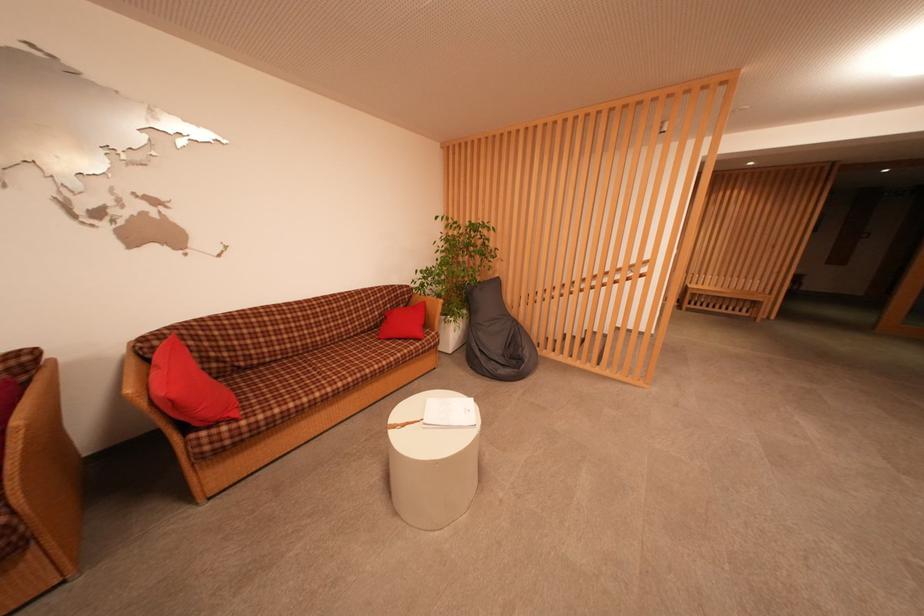
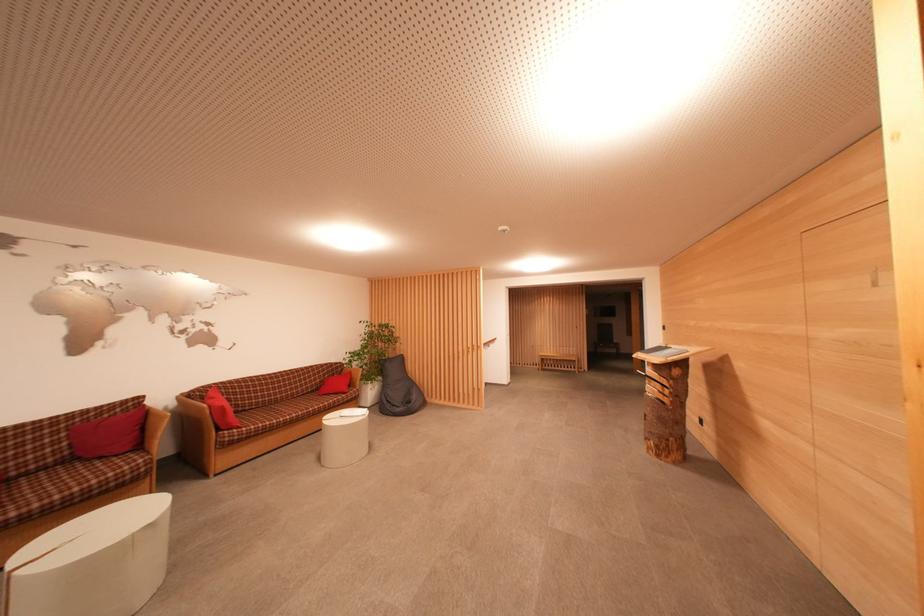
Where in the second image is the point corresponding to point (495, 278) from the first image?

(402, 357)